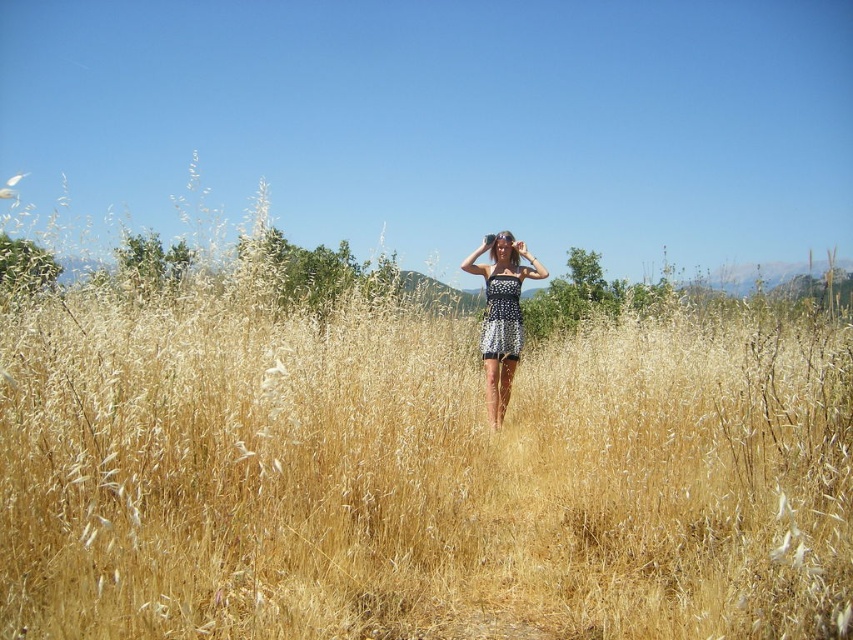
Is white dotted dress at center below black dotted dress at center?

Correct, white dotted dress at center is located below black dotted dress at center.

Can you confirm if white dotted dress at center is positioned to the left of black dotted dress at center?

Indeed, white dotted dress at center is positioned on the left side of black dotted dress at center.

Is point (485, 369) farther from camera compared to point (488, 324)?

No, it is not.

Identify the location of white dotted dress at center. (502, 314).